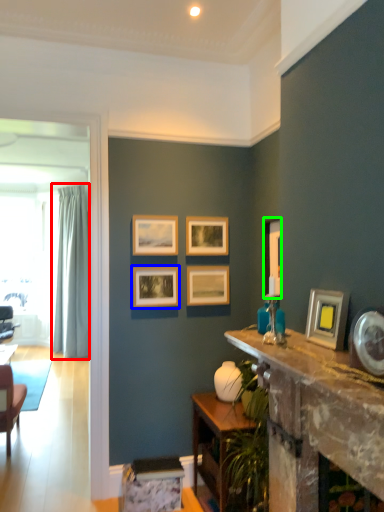
Question: Which is farther away from curtain (highlighted by a red box)? picture frame (highlighted by a blue box) or picture frame (highlighted by a green box)?

Choices:
 (A) picture frame
 (B) picture frame

Answer: (B)